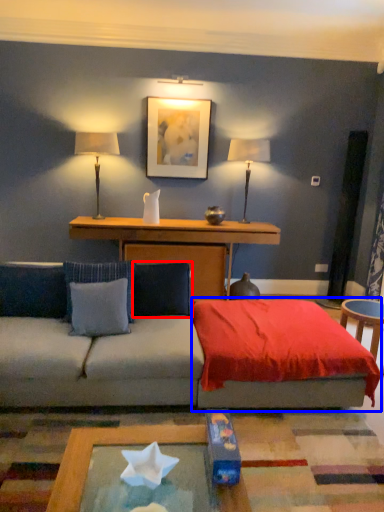
Question: Which object is further to the camera taking this photo, pillow (highlighted by a red box) or bedding (highlighted by a blue box)?

Choices:
 (A) pillow
 (B) bedding

Answer: (A)